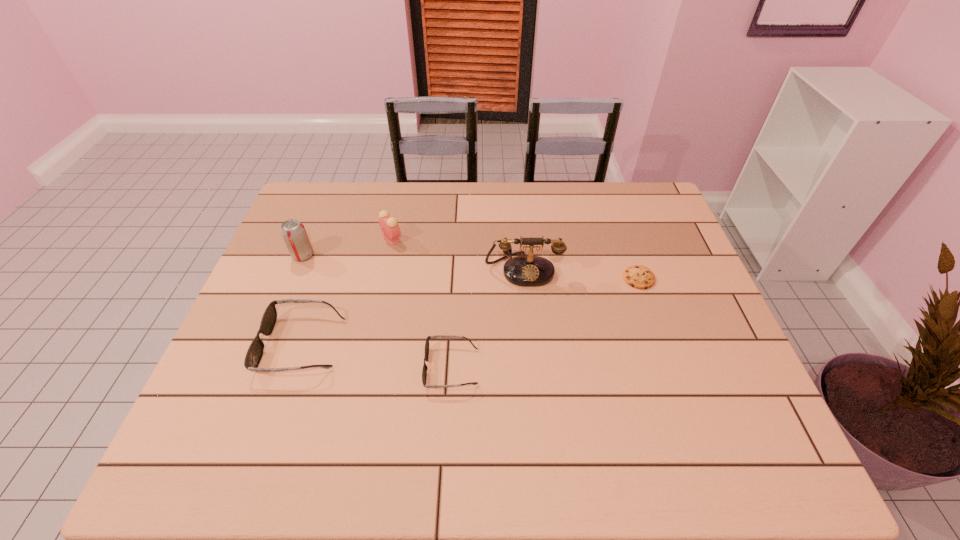
Considering the uniform spacing of sunglassess, where should an additional sunglasses be positioned on the right? Please locate a free spot. Please provide its 2D coordinates. Your answer should be formatted as a tuple, i.e. [(x, y)], where the tuple contains the x and y coordinates of a point satisfying the conditions above.

[(615, 393)]